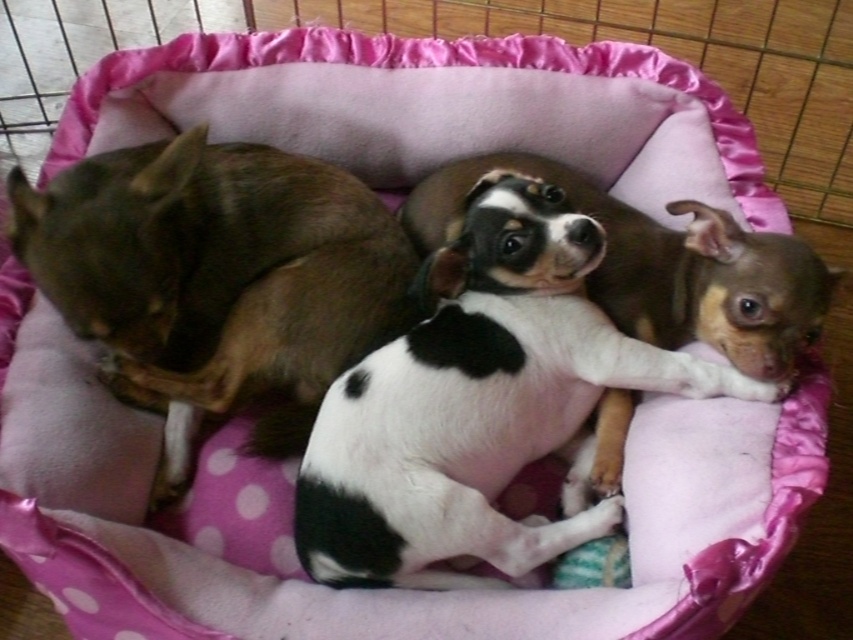
You are a pet owner who wants to ensure all your dogs are comfortable. Given the scene described, which dog would require a higher platform for their comfort, the black and white fur at center or the brown furry dog at left?

The black and white fur at center is much taller than the brown furry dog at left, so it would require a higher platform for their comfort.

Where is the black and white fur at center located in the image?

The black and white fur at center is located at point 0.633 in the x coordinate and 0.564 in the y coordinate.